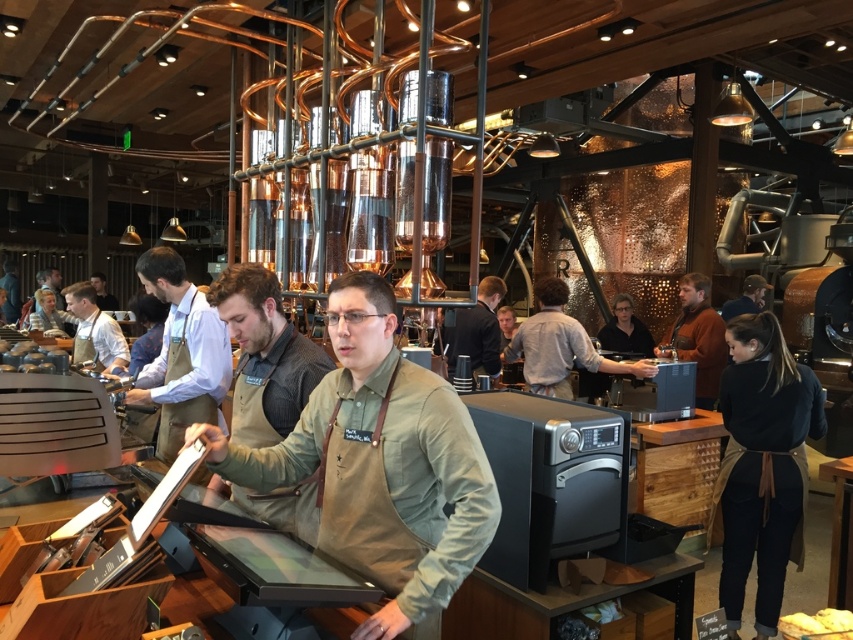
From the picture: You are a customer at the coffee shop and want to place your matte brown leather jacket at upper right on top of the white bread at lower right. Is this possible based on their sizes?

The white bread at lower right is not as tall as the matte brown leather jacket at upper right, so the jacket is taller than the bread. Therefore, placing the matte brown leather jacket at upper right on top of the white bread at lower right would not be possible because the jacket is taller and might not fit properly.

You are a customer in the coffee shop and want to hand your jacket to the staff member wearing the matte black apron at center. Your jacket is the matte brown leather jacket at upper right. Can you directly hand it to them without moving closer?

The distance between the matte brown leather jacket at upper right and the matte black apron at center is 9.38 meters. Since this distance is quite large, you would need to move closer to hand the jacket directly to the staff member.